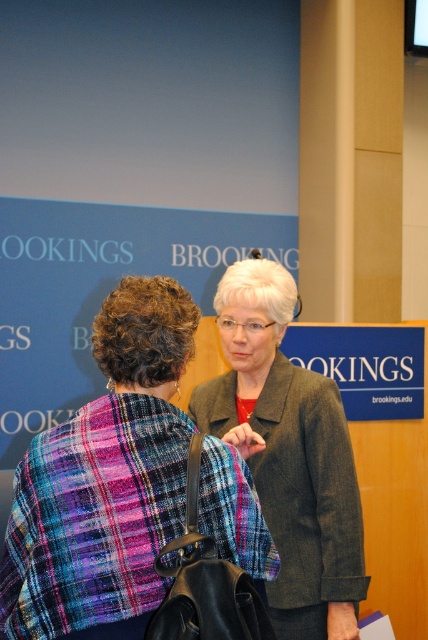
Can you confirm if plaid fabric shawl at center is thinner than matte brown blazer at center?

Incorrect, plaid fabric shawl at center's width is not less than matte brown blazer at center's.

From the picture: Does plaid fabric shawl at center appear over matte brown blazer at center?

Yes.

Identify the location of plaid fabric shawl at center. This screenshot has height=640, width=428. (104, 481).

You are a GUI agent. You are given a task and a screenshot of the screen. Output one action in this format:
    pyautogui.click(x=<x>, y=<y>)
    Task: Click on the plaid fabric shawl at center
    
    Given the screenshot: What is the action you would take?
    pyautogui.click(x=104, y=481)